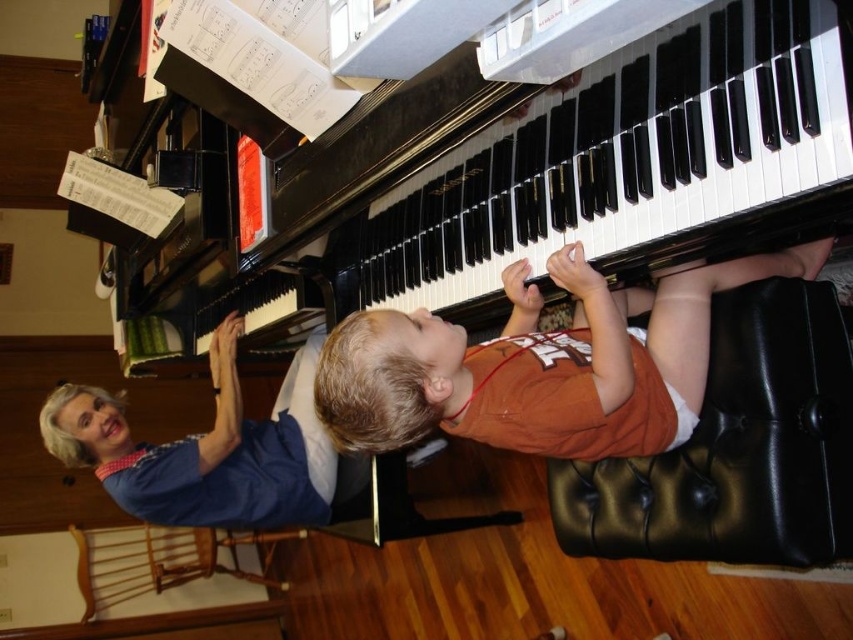
Question: From the image, what is the correct spatial relationship of black polished piano at center in relation to wooden chair at lower left?

Choices:
 (A) left
 (B) right

Answer: (B)

Question: Which object appears farthest from the camera in this image?

Choices:
 (A) wooden chair at lower left
 (B) blue fabric shirt at upper left
 (C) black leather ottoman at lower right

Answer: (A)

Question: Is black leather ottoman at lower right thinner than blue fabric shirt at upper left?

Choices:
 (A) yes
 (B) no

Answer: (A)

Question: Estimate the real-world distances between objects in this image. Which object is closer to the orange cotton shirt at center?

Choices:
 (A) black polished piano at center
 (B) wooden chair at lower left
 (C) blue fabric shirt at upper left

Answer: (A)

Question: Which object appears closest to the camera in this image?

Choices:
 (A) wooden chair at lower left
 (B) orange cotton shirt at center

Answer: (B)

Question: Is orange cotton shirt at center behind wooden chair at lower left?

Choices:
 (A) no
 (B) yes

Answer: (A)